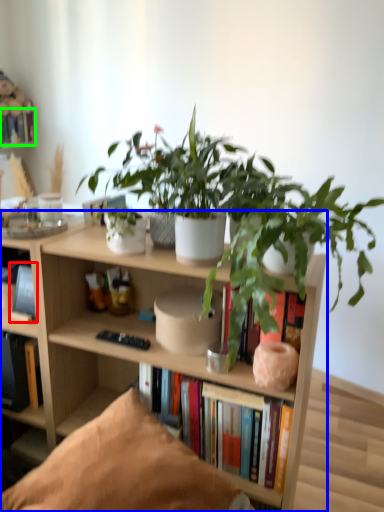
Question: Based on their relative distances, which object is nearer to book (highlighted by a red box)? Choose from bookcase (highlighted by a blue box) and book (highlighted by a green box).

Choices:
 (A) bookcase
 (B) book

Answer: (A)